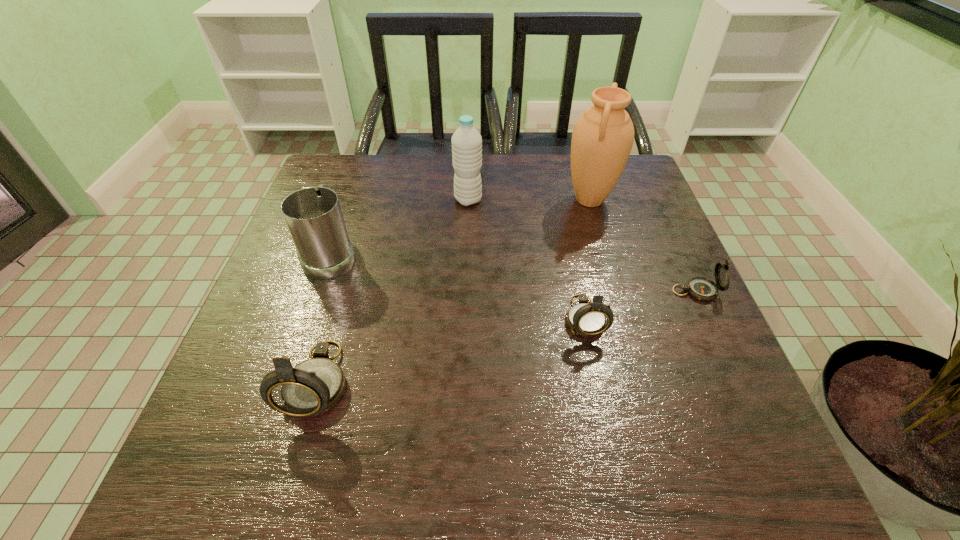
Locate an element on the screen. Image resolution: width=960 pixels, height=540 pixels. vacant position at the near right corner of the desktop is located at coordinates (672, 381).

Identify the location of vacant point located between the second shortest object and the leftmost compass. (451, 349).

I want to click on free space between the third farthest object and the rightmost object, so click(x=514, y=272).

Image resolution: width=960 pixels, height=540 pixels. I want to click on vacant region between the fifth tallest object and the shortest compass, so click(x=639, y=305).

Locate an element on the screen. empty space between the urn and the leftmost compass is located at coordinates (454, 291).

Locate an element on the screen. The image size is (960, 540). vacant area that lies between the second shortest object and the mug is located at coordinates (458, 286).

I want to click on free point between the leftmost compass and the fifth tallest object, so click(451, 349).

This screenshot has height=540, width=960. Find the location of `vacant area that lies between the rightmost object and the leftmost compass`. vacant area that lies between the rightmost object and the leftmost compass is located at coordinates (507, 336).

I want to click on free spot between the shortest compass and the urn, so click(x=642, y=245).

Locate an element on the screen. The width and height of the screenshot is (960, 540). vacant area that lies between the water bottle and the mug is located at coordinates (400, 227).